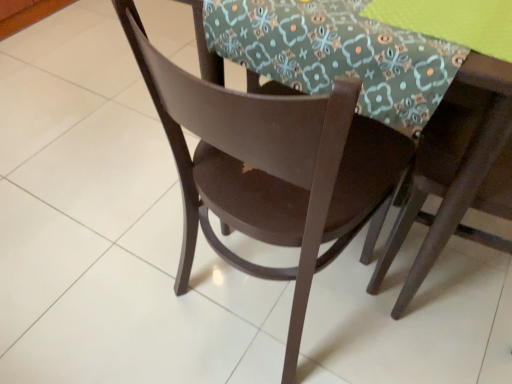
Question: In terms of width, does matte brown chair at center, which is the 2th chair from right to left, look wider or thinner when compared to matte brown table at center?

Choices:
 (A) wide
 (B) thin

Answer: (B)

Question: Visually, is matte brown chair at center, which is the 2th chair from right to left, positioned to the left or to the right of matte brown table at center?

Choices:
 (A) left
 (B) right

Answer: (A)

Question: Estimate the real-world distances between objects in this image. Which object is farther from the floral fabric at center?

Choices:
 (A) matte brown chair at center, acting as the first chair starting from the left
 (B) matte brown table at center
 (C) matte brown chair at upper right, marked as the 2th chair in a left-to-right arrangement

Answer: (A)

Question: Which object is positioned farthest from the matte brown table at center?

Choices:
 (A) floral fabric at center
 (B) matte brown chair at center, which is the 2th chair from right to left
 (C) matte brown chair at upper right, the first chair when ordered from right to left

Answer: (B)